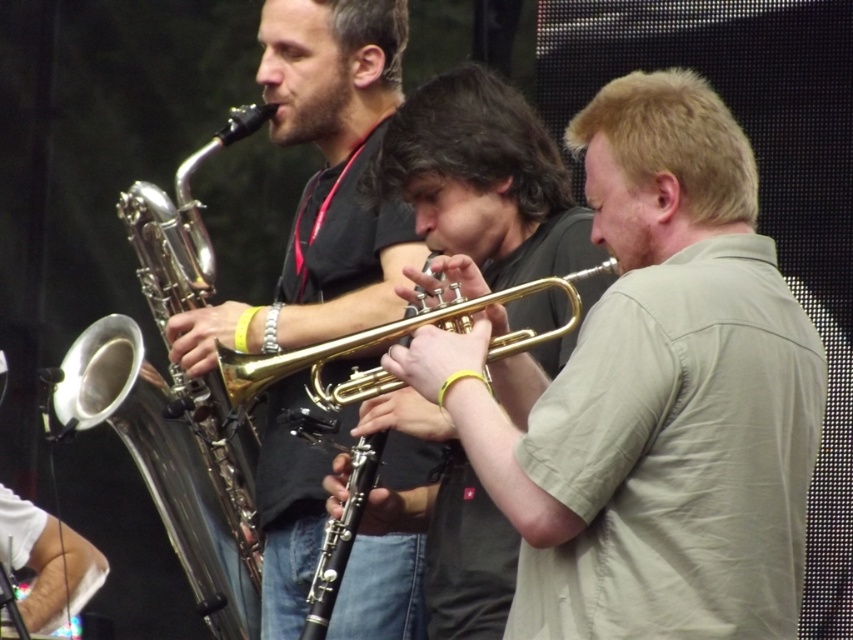
You are a stagehand who needs to adjust the spacing between the gold brass trumpet at center and the shiny brass saxophone at left. The recommended minimum distance between instruments is 4 feet for sound clarity. Based on the image, is the current spacing sufficient?

The distance between the gold brass trumpet at center and the shiny brass saxophone at left is 3.98 feet, which is slightly less than the recommended 4 feet. Therefore, the current spacing is insufficient for optimal sound clarity.

Looking at this image, you are a photographer at the live musical performance. You want to capture a photo where the gold brass trumpet at center and the shiny brass saxophone at left are both visible. Based on their positions, which instrument should be placed on the right side of the photo to ensure they are both in frame?

The gold brass trumpet at center should be placed on the right side of the photo because it is positioned on the right side of the shiny brass saxophone at left, so arranging them with the trumpet on the right will mirror their actual positions and keep both in frame.

In the scene shown: You are a photographer at the live musical performance. You want to capture a photo where the gold brass trumpet at center is visible above the gold shiny trumpet at center. Is this possible based on their current positions?

The gold brass trumpet at center is located below the gold shiny trumpet at center, so it is not possible to capture a photo where the gold brass trumpet at center is visible above the gold shiny trumpet at center.